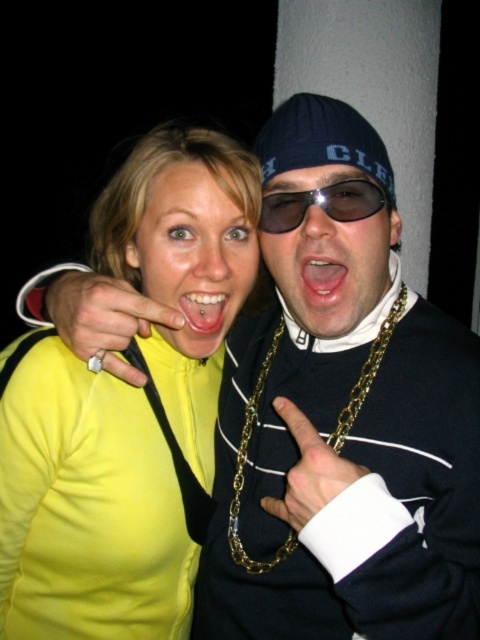
You are a photographer trying to focus on the pink glossy lips at center in the image. However, the matte yellow jacket at center is blocking your view. Can you adjust your camera angle to capture the lips without the jacket obstructing the shot?

The matte yellow jacket at center is taller than pink glossy lips at center, so adjusting the camera angle downward might allow you to capture the pink glossy lips at center without the jacket obstructing the shot.

You are trying to locate the matte yellow jacket at center in the image. According to the coordinates provided, where exactly is it positioned?

The matte yellow jacket at center is located at point coordinates of 0.400 on the x axis and 0.404 on the y axis.

You are a photographer trying to focus on the matte yellow jacket at center and the matte black sunglasses at center in the image. Which object is located to the left of the other?

The matte yellow jacket at center is positioned on the left side of matte black sunglasses at center.